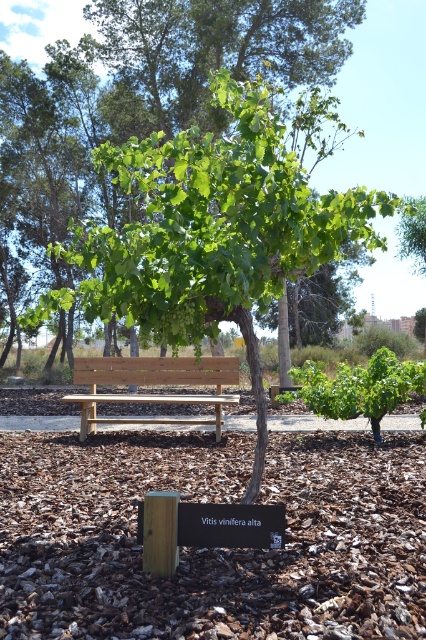
Does green leafy tree at center have a greater height compared to wooden bench at center?

Indeed, green leafy tree at center has a greater height compared to wooden bench at center.

Is green leafy tree at center in front of wooden bench at center?

Yes.

Where is `green leafy tree at center`? Image resolution: width=426 pixels, height=640 pixels. green leafy tree at center is located at coordinates (213, 230).